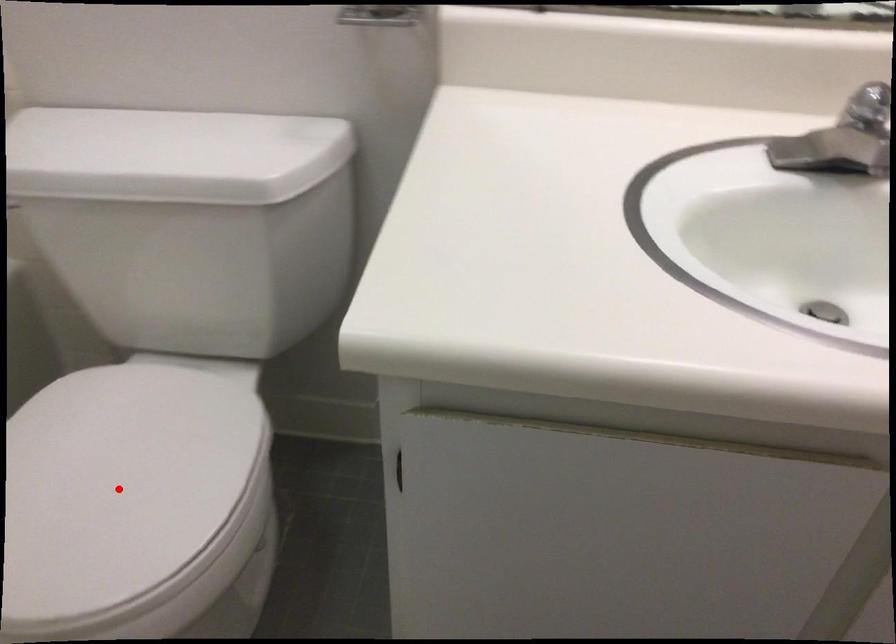
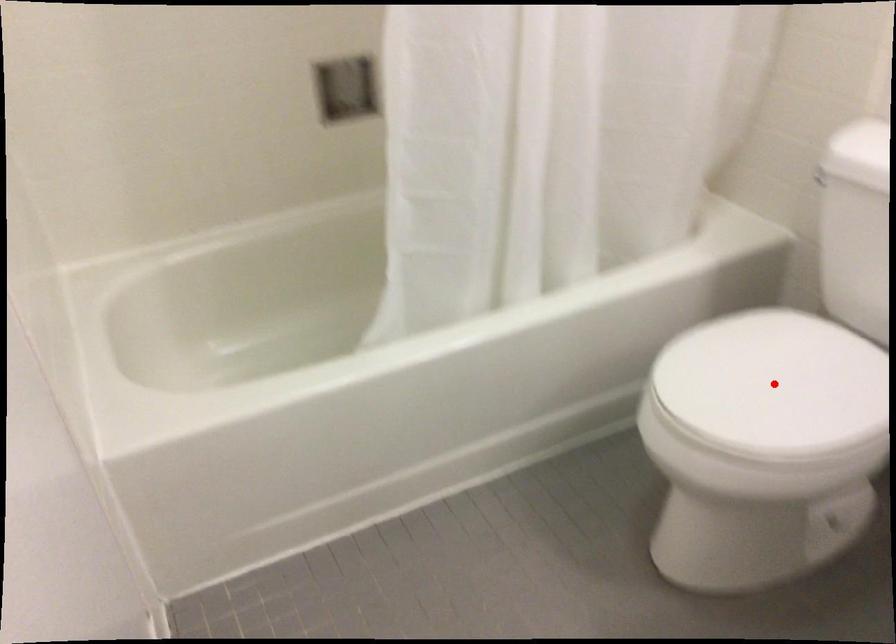
From the picture: I am providing you with two images of the same scene from different viewpoints. A red point is marked on the first image and another point is marked on the second image. Is the marked point in image1 the same physical position as the marked point in image2?

Yes